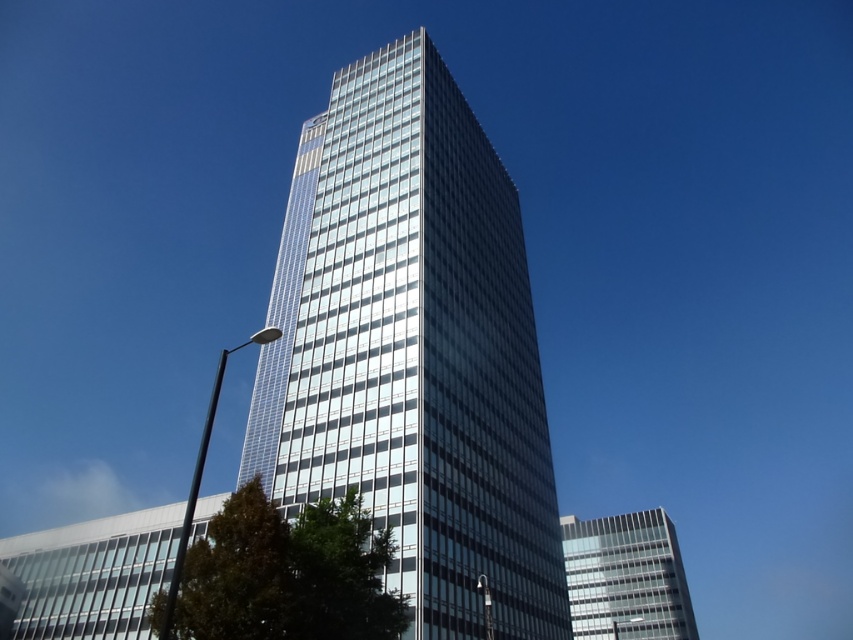
Question: Can you confirm if transparent glass tower at center is positioned above clear glass building at lower right?

Choices:
 (A) yes
 (B) no

Answer: (A)

Question: Which point is closer to the camera?

Choices:
 (A) (581, 545)
 (B) (488, 560)

Answer: (B)

Question: Can you confirm if transparent glass tower at center is positioned to the left of clear glass building at lower right?

Choices:
 (A) yes
 (B) no

Answer: (A)

Question: Which point appears closest to the camera in this image?

Choices:
 (A) (277, 298)
 (B) (573, 577)

Answer: (B)

Question: Which point is closer to the camera taking this photo?

Choices:
 (A) (577, 595)
 (B) (518, 392)

Answer: (B)

Question: Does transparent glass tower at center appear over clear glass building at lower right?

Choices:
 (A) yes
 (B) no

Answer: (A)